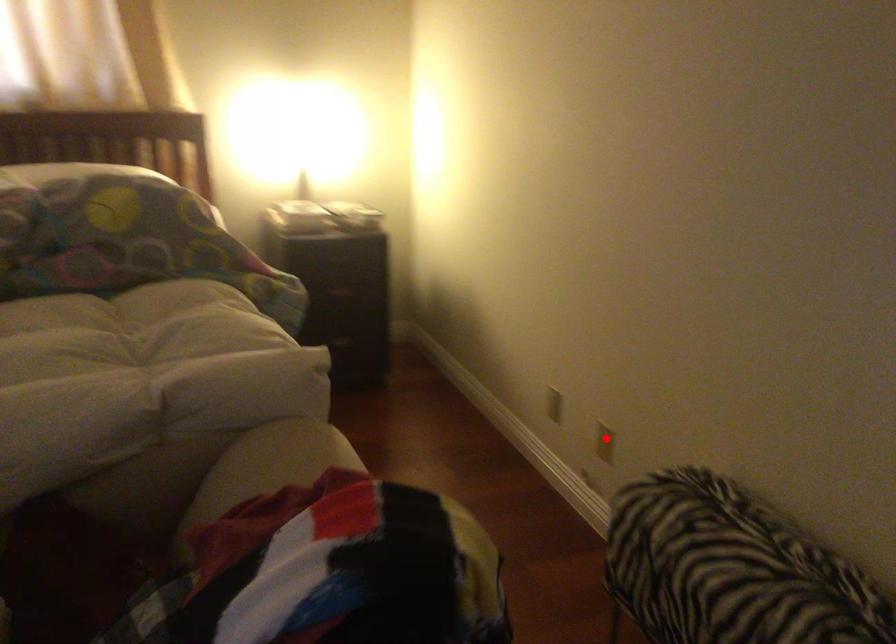
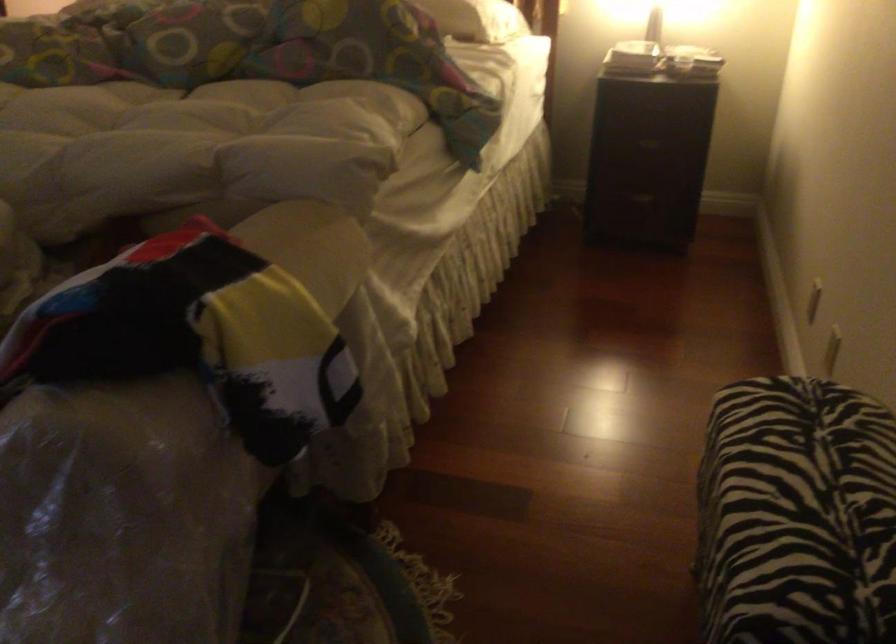
Question: I am providing you with two images of the same scene from different viewpoints. Given a red point in image1, look at the same physical point in image2. Is it:

Choices:
 (A) Closer to the viewpoint
 (B) Farther from the viewpoint

Answer: (A)